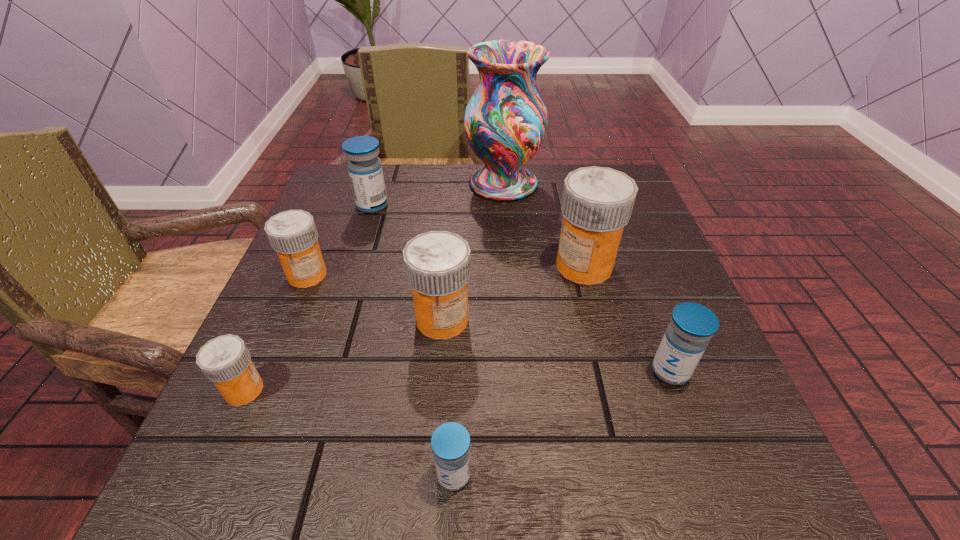
Locate an element on the screen. vase is located at coordinates (505, 121).

The width and height of the screenshot is (960, 540). Identify the location of the seventh shortest object. (597, 202).

I want to click on the tallest medicine, so click(x=597, y=202).

You are a GUI agent. You are given a task and a screenshot of the screen. Output one action in this format:
    pyautogui.click(x=<x>, y=<y>)
    Task: Click on the third medicine from left to right
    
    Given the screenshot: What is the action you would take?
    pyautogui.click(x=365, y=170)

Locate an element on the screen. The image size is (960, 540). the biggest blue medicine is located at coordinates (365, 170).

Locate an element on the screen. The width and height of the screenshot is (960, 540). the fourth farthest medicine is located at coordinates (438, 266).

Where is `the third orange medicine from left to right`? This screenshot has height=540, width=960. the third orange medicine from left to right is located at coordinates (438, 266).

Where is `the third biggest orange medicine`? This screenshot has height=540, width=960. the third biggest orange medicine is located at coordinates (292, 234).

Find the location of a particular element. The height and width of the screenshot is (540, 960). the rightmost medicine is located at coordinates (692, 325).

You are a GUI agent. You are given a task and a screenshot of the screen. Output one action in this format:
    pyautogui.click(x=<x>, y=<y>)
    Task: Click on the rightmost blue medicine
    The height and width of the screenshot is (540, 960).
    Given the screenshot: What is the action you would take?
    pyautogui.click(x=692, y=325)